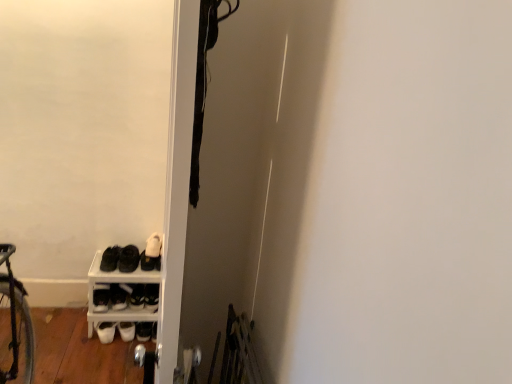
Question: Looking at the image, does white matte shoe rack at lower left seem bigger or smaller compared to white leather shoe at lower left, the fourth footwear positioned from the left?

Choices:
 (A) small
 (B) big

Answer: (B)

Question: Is point (98, 253) positioned closer to the camera than point (148, 286)?

Choices:
 (A) farther
 (B) closer

Answer: (A)

Question: Considering the real-world distances, which object is closest to the white matte sneakers at lower left, the first footwear viewed from the left?

Choices:
 (A) white leather shoe at lower left, marked as the first footwear in a right-to-left arrangement
 (B) black matte shoes at lower left, which appears as the third footwear when viewed from the right
 (C) white matte shoe at lower left, the third footwear viewed from the left
 (D) white matte shoe rack at lower left

Answer: (D)

Question: Estimate the real-world distances between objects in this image. Which object is farther from the black matte shoes at lower left, which is the second footwear from left to right?

Choices:
 (A) white matte shoe at lower left, which ranks as the second footwear in right-to-left order
 (B) white matte shoe rack at lower left
 (C) white matte sneakers at lower left, the first footwear viewed from the left
 (D) white leather shoe at lower left, the fourth footwear positioned from the left

Answer: (C)